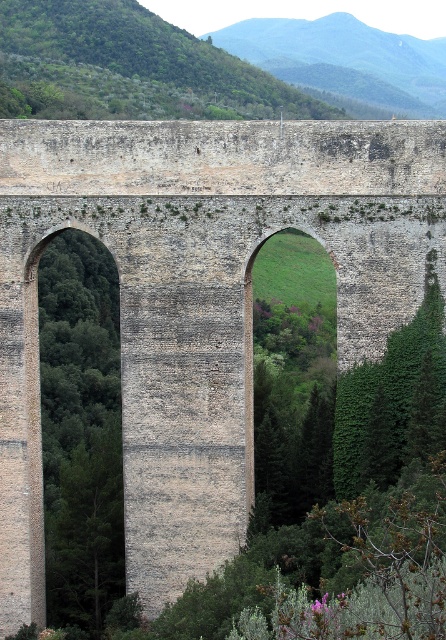
Question: Which point is farther to the camera?

Choices:
 (A) (327, 16)
 (B) (162, 74)

Answer: (A)

Question: Where is green leafy tree at upper left located in relation to green leafy hillside at upper center in the image?

Choices:
 (A) above
 (B) below

Answer: (B)

Question: Is green leafy tree at upper left positioned in front of green leafy hillside at upper center?

Choices:
 (A) yes
 (B) no

Answer: (A)

Question: Does green leafy tree at upper left have a lesser width compared to green leafy hillside at upper center?

Choices:
 (A) yes
 (B) no

Answer: (B)

Question: Which point is closer to the camera?

Choices:
 (A) (85, 4)
 (B) (331, 44)

Answer: (A)